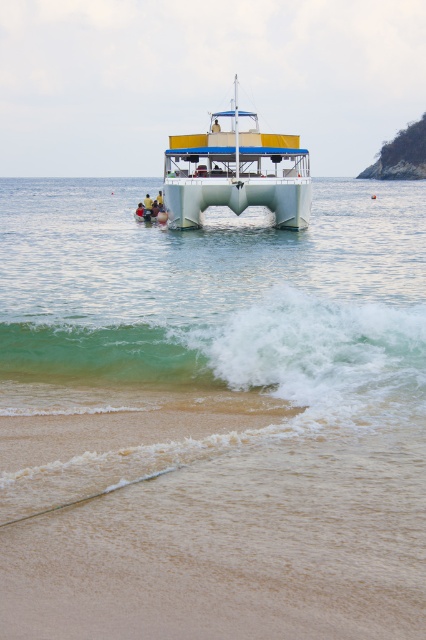
Question: Does sandy beach at lower center have a lesser width compared to white plastic boat at center?

Choices:
 (A) yes
 (B) no

Answer: (A)

Question: Which point is farther to the camera?

Choices:
 (A) (198, 442)
 (B) (187, 216)
 (C) (419, 380)

Answer: (B)

Question: Can you confirm if sandy beach at lower center is smaller than green translucent water at lower center?

Choices:
 (A) yes
 (B) no

Answer: (B)

Question: Which of the following is the closest to the observer?

Choices:
 (A) sandy beach at lower center
 (B) green translucent water at lower center

Answer: (A)

Question: Does sandy beach at lower center have a greater width compared to green translucent water at lower center?

Choices:
 (A) no
 (B) yes

Answer: (B)

Question: Which object is closer to the camera taking this photo?

Choices:
 (A) sandy beach at lower center
 (B) green translucent water at lower center

Answer: (A)